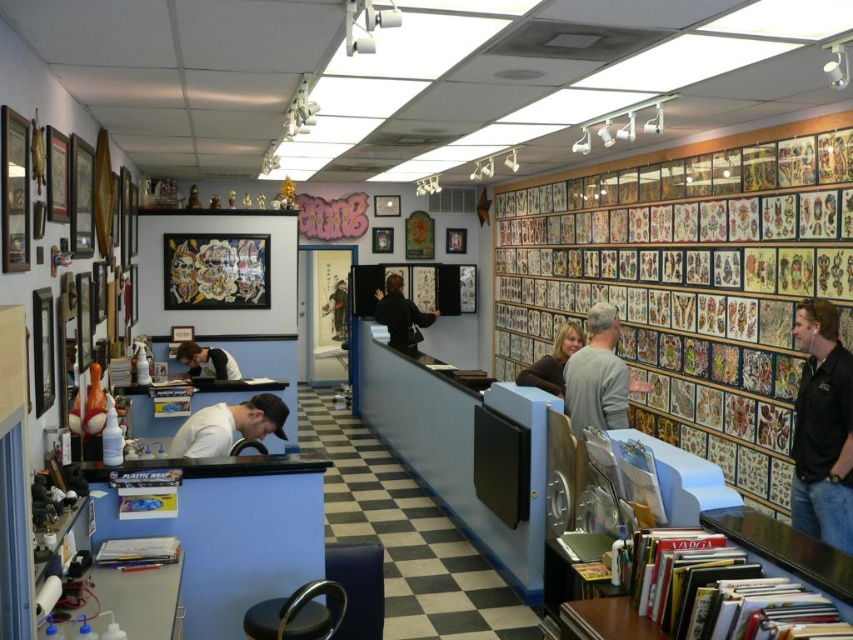
You are a customer in the tattoo parlor and want to ask the person at the counter a question. Which object should you approach first, the gray sweater at center or the matte brown hair at center?

You should approach the matte brown hair at center first because the gray sweater at center is to the right of it, meaning the matte brown hair at center is closer to your left side where the counter is located.

Based on the photo, you are a customer in the tattoo parlor and want to sit down. You see the black leather jacket at right and the black leather stool at lower center. Is the stool available for you to sit on?

The black leather jacket at right is positioned over the black leather stool at lower center, which indicates that the stool is currently occupied or in use, so it may not be available for you to sit on.